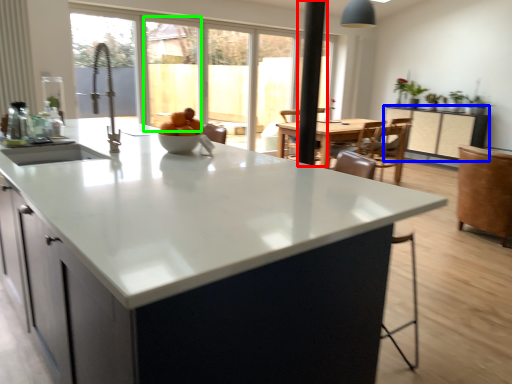
Question: Considering the real-world distances, which object is closest to pole (highlighted by a red box)? cabinetry (highlighted by a blue box) or window screen (highlighted by a green box).

Choices:
 (A) cabinetry
 (B) window screen

Answer: (A)